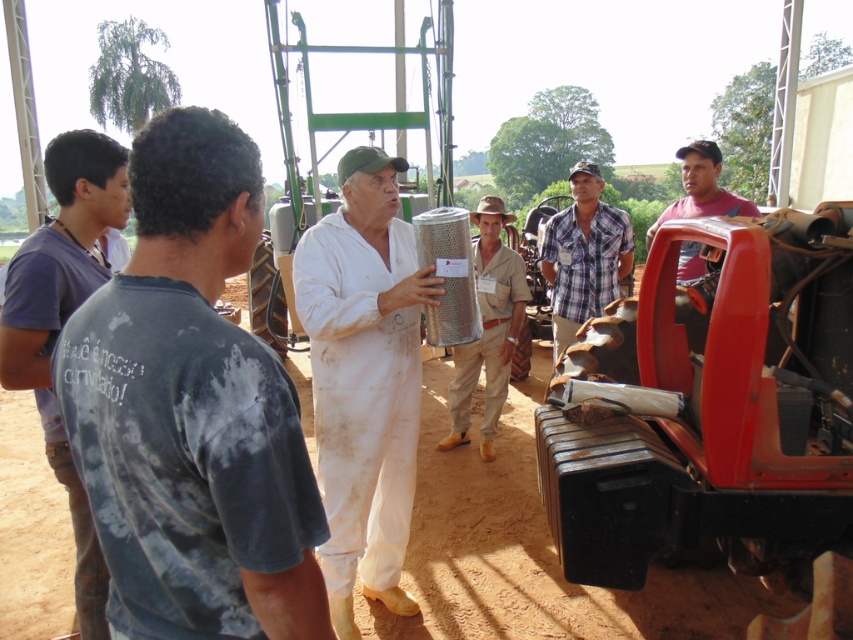
From the picture: You are a photographer trying to capture a group photo of the scene. You need to ensure everyone is in focus. The camera you are using has a depth of field that can sharply focus on objects within 2 meters. Will both the white matte jumpsuit at center and the plaid fabric shirt at center be in focus?

The white matte jumpsuit at center is 2.01 meters from the plaid fabric shirt at center. Since the distance between them is just over 2 meters, the camera cannot keep both in focus simultaneously due to the 2 meter depth of field limit.